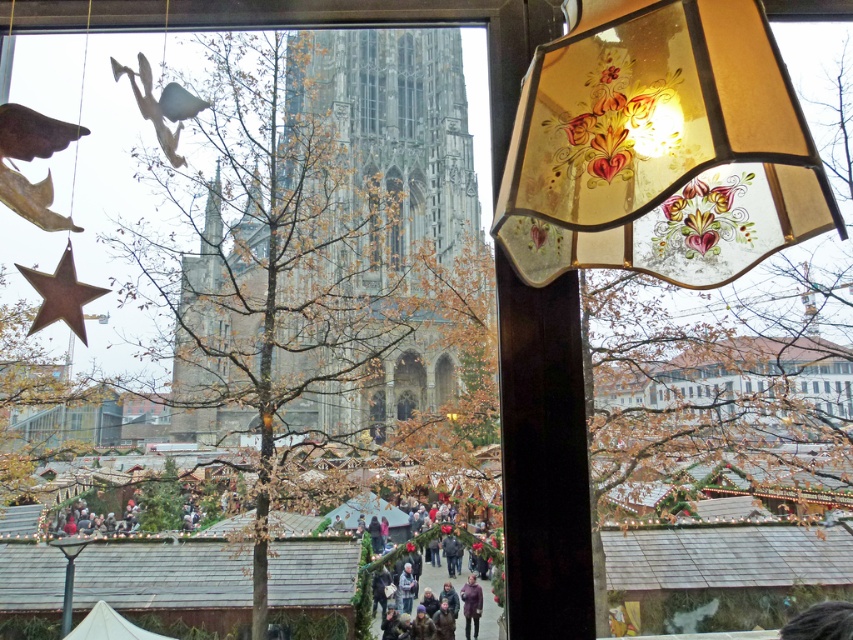
You are an interior designer looking to replace the translucent stained glass lampshade at upper right and the white fabric canopy at lower left. You want to ensure that the new items maintain the same spatial relationship as the current ones. Which item should be placed in front of the other?

The translucent stained glass lampshade at upper right should be placed in front of the white fabric canopy at lower left to maintain the current spatial relationship.

You are a delivery drone with a maximum flight range of 200 feet. You need to deliver a package from the translucent stained glass lampshade at upper right to the matte green fabric canopy at center. Can you complete this delivery without needing a recharge?

The distance between the translucent stained glass lampshade at upper right and the matte green fabric canopy at center is 179.44 feet, which is within your 200 feet maximum flight range. Therefore, you can complete the delivery without needing a recharge.

You are standing in the room and want to see the festive market outside the window. However, the white fabric canopy at lower left is blocking your view. Can you move the canopy to the right to clear your line of sight?

The white fabric canopy at lower left is located at point [109,627], so moving it to the right would adjust its position, potentially clearing your view of the festive market outside the window.